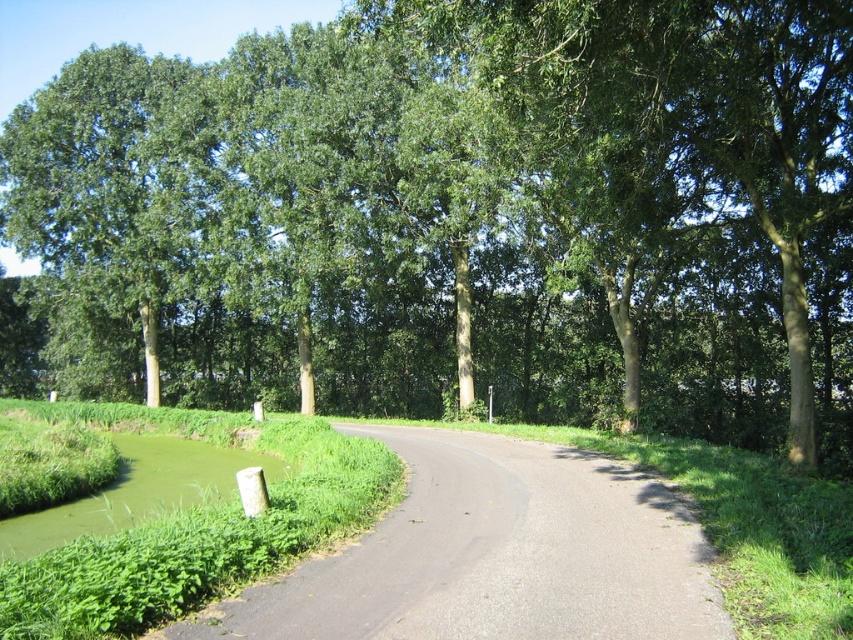
Question: Which point appears farthest from the camera in this image?

Choices:
 (A) (108, 529)
 (B) (271, 632)

Answer: (A)

Question: Estimate the real-world distances between objects in this image. Which object is farther from the black asphalt road at center?

Choices:
 (A) green grassy bank at lower left
 (B) green leafy tree at center

Answer: (B)

Question: Can you confirm if black asphalt road at center is thinner than green grassy bank at lower left?

Choices:
 (A) no
 (B) yes

Answer: (B)

Question: From the image, what is the correct spatial relationship of green leafy tree at center in relation to black asphalt road at center?

Choices:
 (A) below
 (B) above

Answer: (B)

Question: From the image, what is the correct spatial relationship of green leafy tree at center in relation to black asphalt road at center?

Choices:
 (A) right
 (B) left

Answer: (B)

Question: Which of the following is the farthest from the observer?

Choices:
 (A) (349, 44)
 (B) (196, 444)
 (C) (471, 628)

Answer: (A)